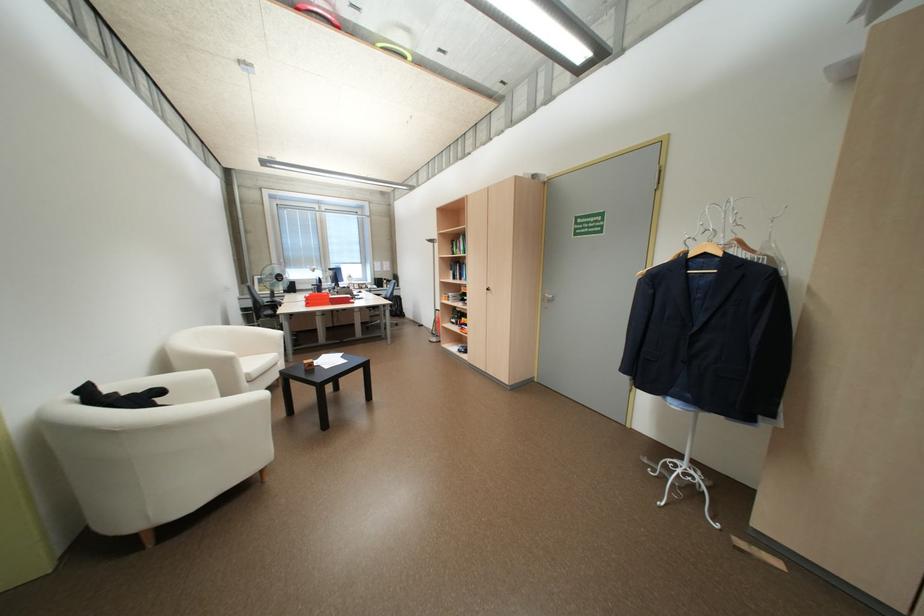
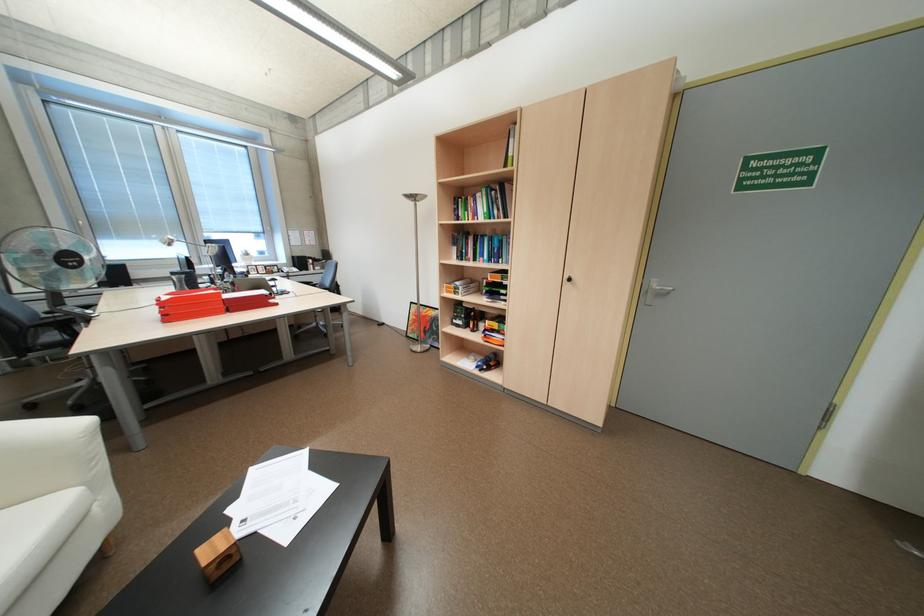
Find the pixel in the second image that matches [463,322] in the first image.

(468, 325)